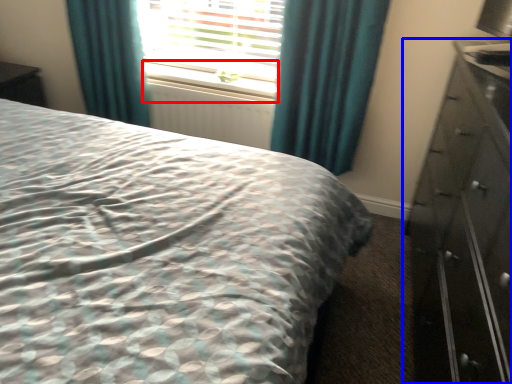
Question: Which object is further to the camera taking this photo, window sill (highlighted by a red box) or chest of drawers (highlighted by a blue box)?

Choices:
 (A) window sill
 (B) chest of drawers

Answer: (A)